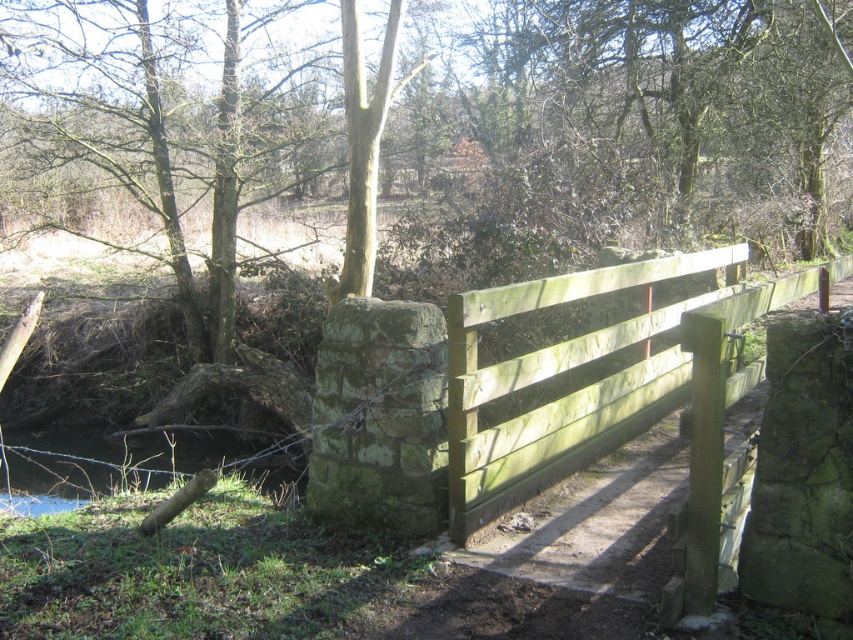
Does green painted wood fence at center have a lesser height compared to green grassy river at lower left?

No.

Between point (569, 451) and point (108, 464), which one is positioned behind?

Positioned behind is point (108, 464).

Between point (541, 420) and point (6, 440), which one is positioned in front?

Point (541, 420) is more forward.

The height and width of the screenshot is (640, 853). What are the coordinates of `green painted wood fence at center` in the screenshot? It's located at (566, 372).